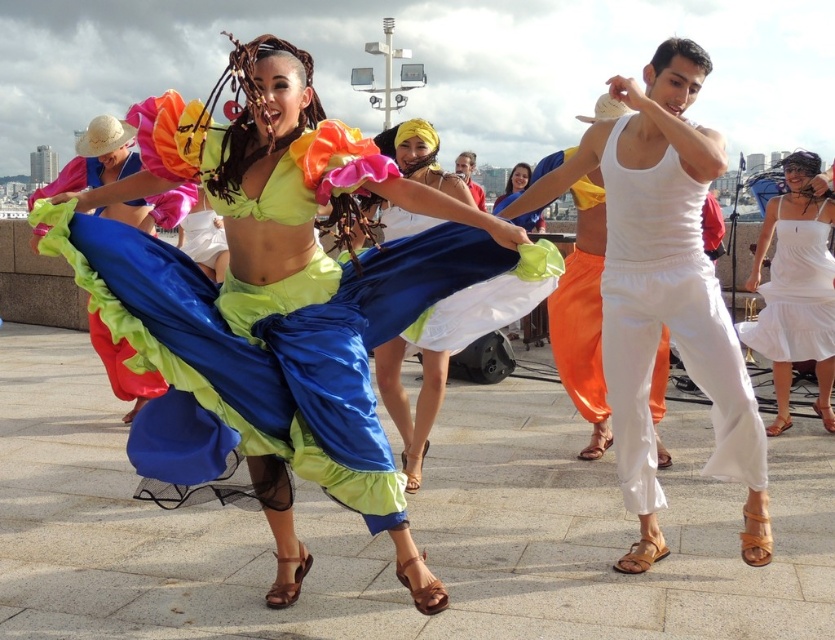
How far apart are shiny satin skirt at center and blue satin skirt at center?

shiny satin skirt at center is 6.67 feet away from blue satin skirt at center.

Can you confirm if shiny satin skirt at center is taller than blue satin skirt at center?

Indeed, shiny satin skirt at center has a greater height compared to blue satin skirt at center.

Who is more distant from viewer, (453,241) or (419,224)?

Positioned behind is point (419,224).

This screenshot has width=835, height=640. I want to click on shiny satin skirt at center, so click(x=277, y=300).

Describe the element at coordinates (671, 296) in the screenshot. I see `white cotton tank top at center` at that location.

Between white cotton tank top at center and blue satin skirt at center, which one appears on the left side from the viewer's perspective?

Positioned to the left is blue satin skirt at center.

This screenshot has height=640, width=835. I want to click on white cotton tank top at center, so click(671, 296).

The image size is (835, 640). Describe the element at coordinates (277, 300) in the screenshot. I see `shiny satin skirt at center` at that location.

Does point (373, 465) come farther from viewer compared to point (823, 330)?

No, (373, 465) is in front of (823, 330).

Image resolution: width=835 pixels, height=640 pixels. Identify the location of shiny satin skirt at center. (277, 300).